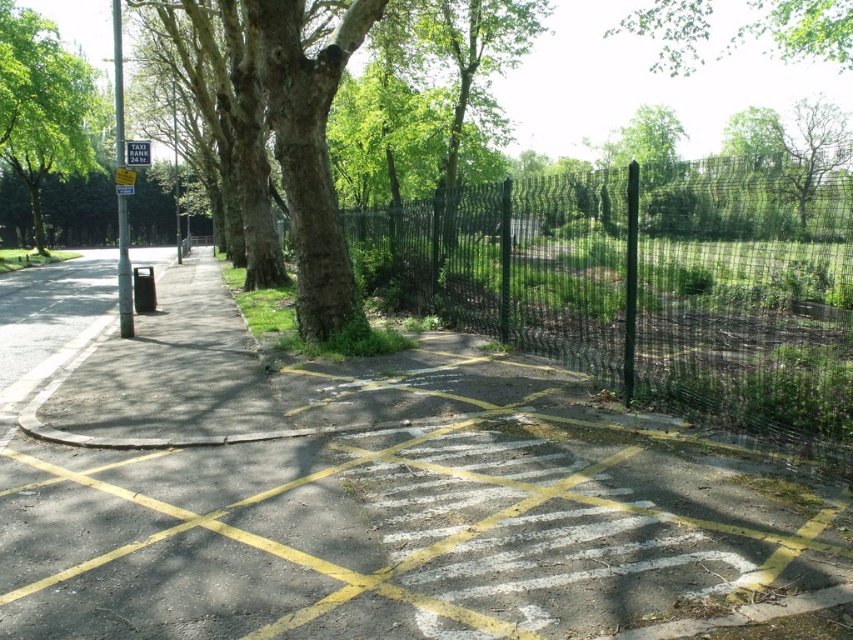
You are a taxi driver looking for the nearest parking spot. You see the green rough bark tree at upper left and the green leafy tree at upper center. Which tree is closer to the TAXI PARK sign?

The green rough bark tree at upper left is smaller than the green leafy tree at upper center. Since smaller objects can sometimes appear closer due to perspective, but the description only mentions size, not distance. However, without explicit distance information, we cannot definitively determine which is closer based on the provided details.

You are standing at the TAXI PARK sign and want to walk to the point with coordinates point (814,40) and point (126,144). Which point is closer to you?

Point (126,144) is closer to you because it is nearer than point (814,40), which is further away from the camera.